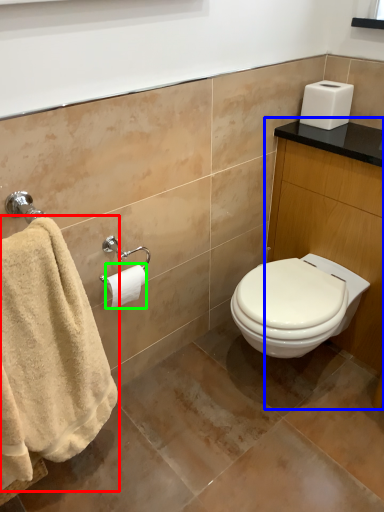
Question: Based on their relative distances, which object is farther from towel (highlighted by a red box)? Choose from vanity (highlighted by a blue box) and toilet paper (highlighted by a green box).

Choices:
 (A) vanity
 (B) toilet paper

Answer: (A)